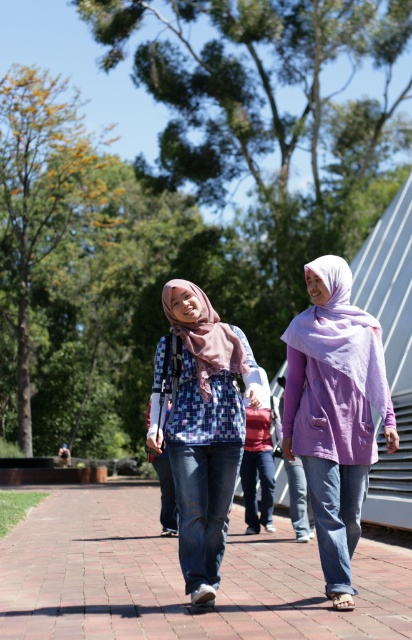
Between purple cotton hijab at center and plaid fabric blouse at center, which one appears on the left side from the viewer's perspective?

Positioned to the left is plaid fabric blouse at center.

Locate an element on the screen. purple cotton hijab at center is located at coordinates (334, 412).

Is point (100, 500) farther from viewer compared to point (241, 356)?

Yes.

Describe the element at coordinates (180, 579) in the screenshot. I see `brick pavement at center` at that location.

The width and height of the screenshot is (412, 640). What are the coordinates of `brick pavement at center` in the screenshot? It's located at (180, 579).

Which is above, purple cotton hijab at center or mauve chiffon hijab at center?

mauve chiffon hijab at center is above.

Is purple cotton hijab at center shorter than mauve chiffon hijab at center?

No.

At what (x,y) coordinates should I click in order to perform the action: click on purple cotton hijab at center. Please return your answer as a coordinate pair (x, y). This screenshot has height=640, width=412. Looking at the image, I should click on (334, 412).